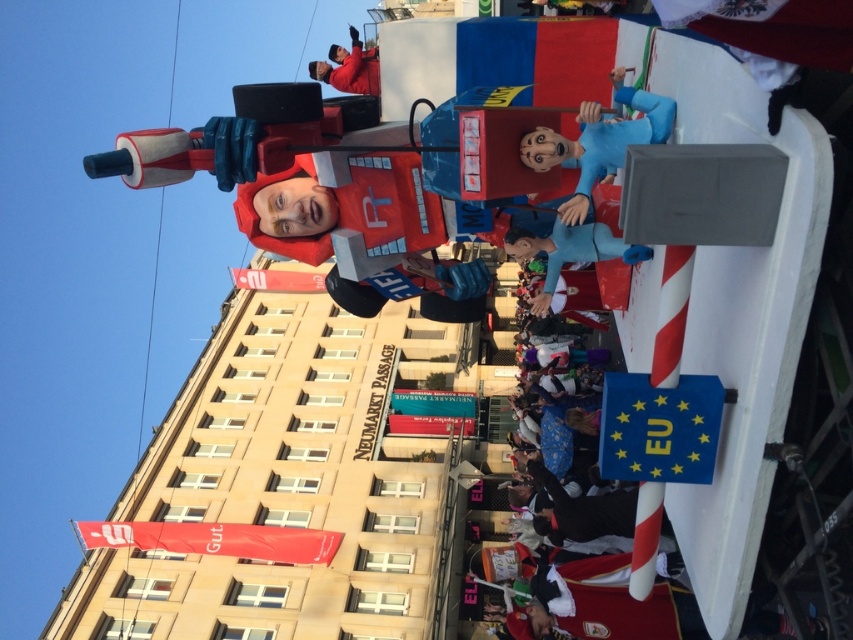
You are standing in front of the float and want to take a photo. If you focus on point (474, 316), will point (165, 547) be in focus as well?

Point (165, 547) is further to the camera than point (474, 316). If you focus on point (474, 316), the point (165, 547) will also be in focus since it is closer to the camera.

In the scene shown: You are standing at the front of the float and want to hand a flag to both the blue matte figure at center and the blue fabric figure at center. Which figure is closer to you?

The blue matte figure at center is 6.17 meters away from the blue fabric figure at center. However, since both are at the center of the float, their distance from you depends on their positioning relative to each other. Without specific information about their exact positions from your location, it is impossible to determine which one is closer.

You are standing in the crowd watching the float. You see the red fabric banner at lower left and the blue fabric figure at center. Which object is positioned more to the left side of the float?

The red fabric banner at lower left is positioned more to the left side of the float than the blue fabric figure at center.